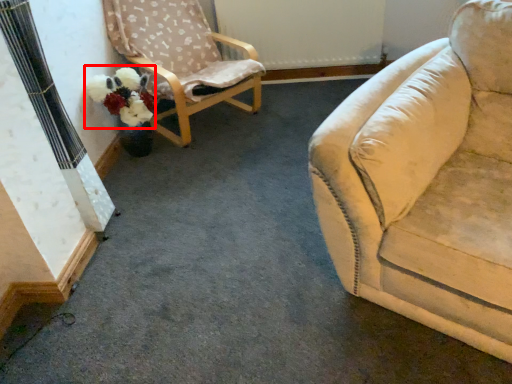
Question: From the image's perspective, what is the correct spatial positioning of flower (annotated by the red box) in reference to chair?

Choices:
 (A) below
 (B) above

Answer: (A)